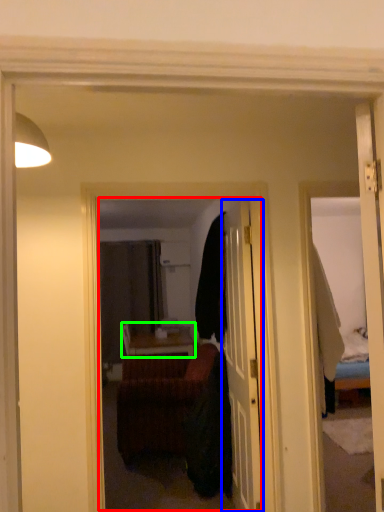
Question: Which object is positioned farthest from mirror (highlighted by a red box)? Select from door (highlighted by a blue box) and table (highlighted by a green box).

Choices:
 (A) door
 (B) table

Answer: (A)